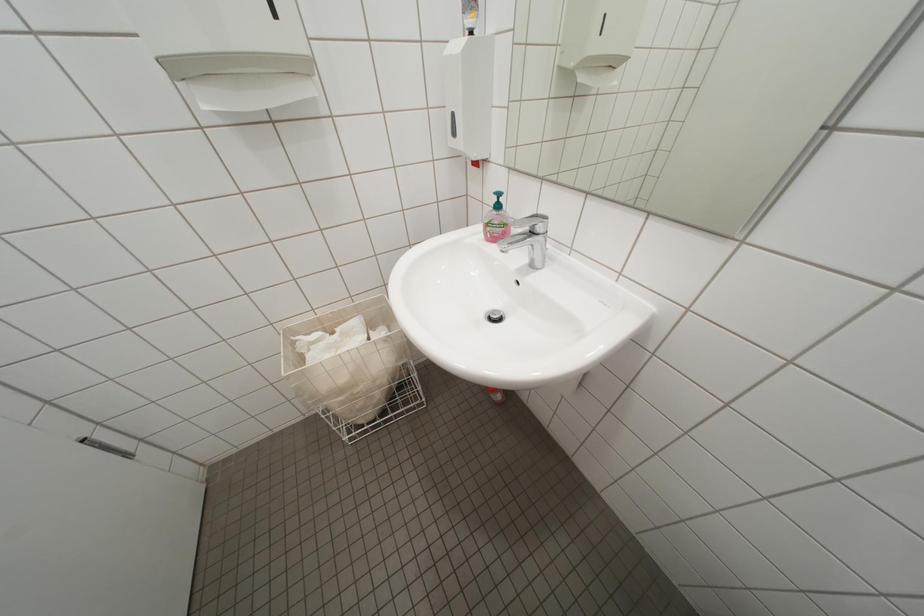
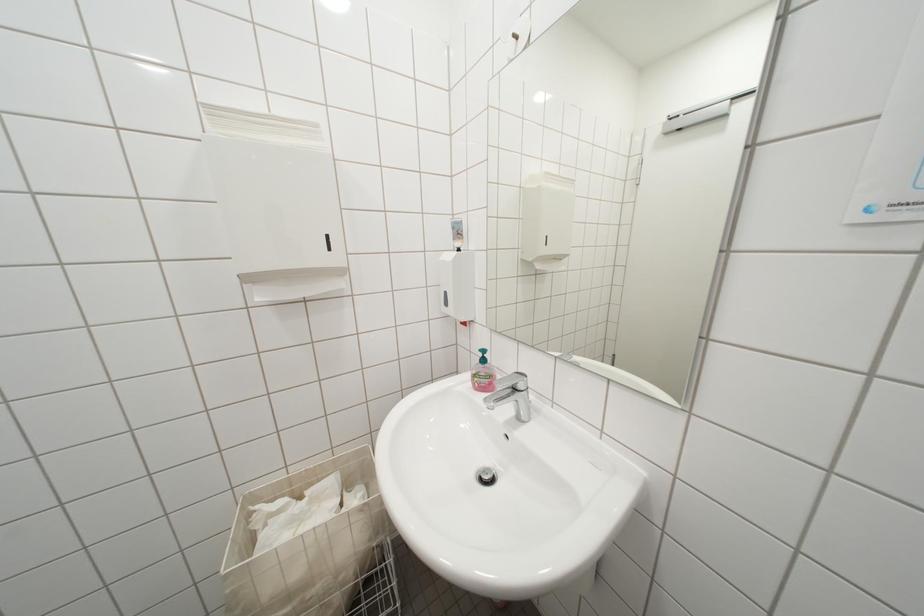
Question: Based on the continuous images, in which direction is the camera rotating? Reply with the corresponding letter.

Choices:
 (A) Left
 (B) Right
 (C) Up
 (D) Down

Answer: (C)